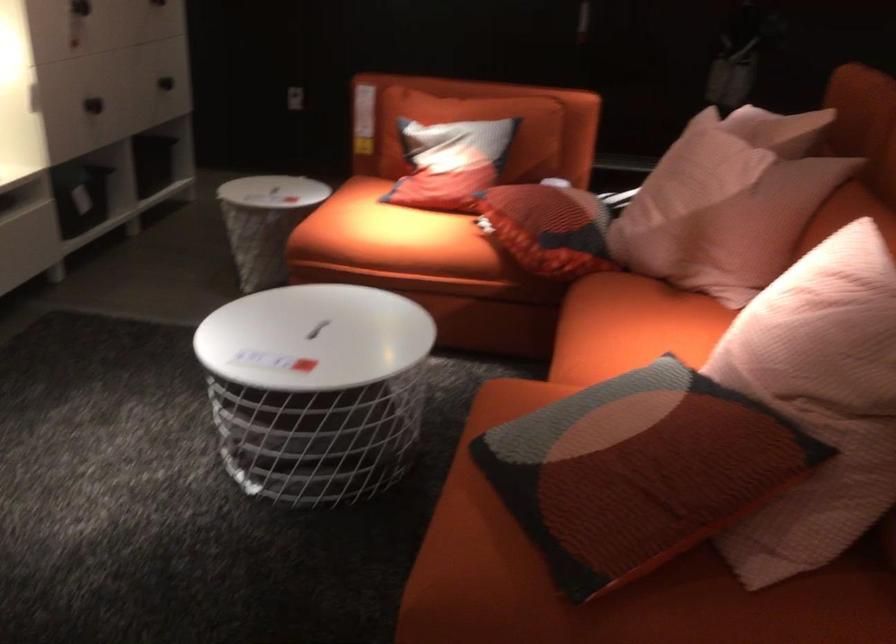
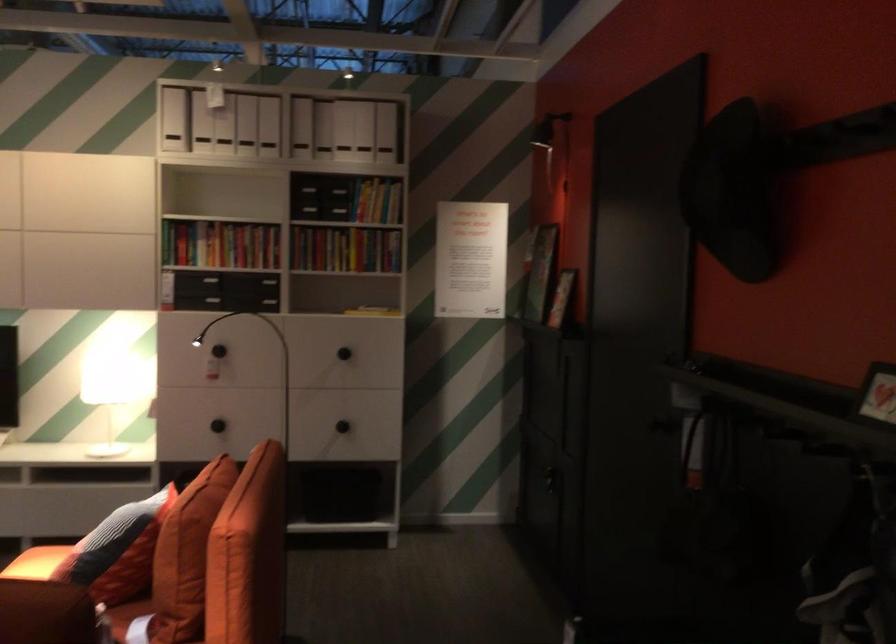
In the second image, find the point that corresponds to pixel 514 144 in the first image.

(117, 551)